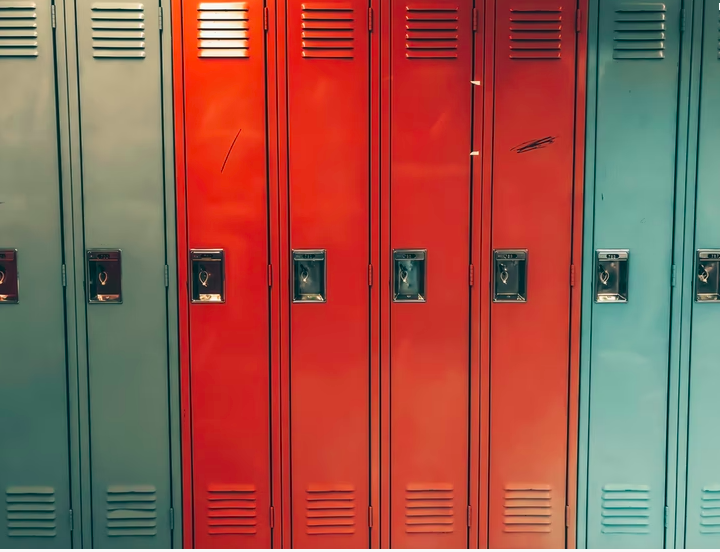
I want to click on handle to open lockers, so click(703, 282), click(605, 280), click(505, 283), click(404, 282), click(302, 289), click(204, 286), click(104, 286), click(1, 286).